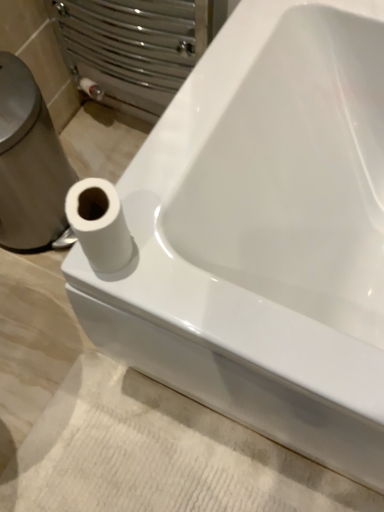
This screenshot has width=384, height=512. Identify the location of free spot to the right of white matte toilet paper at lower left. (200, 284).